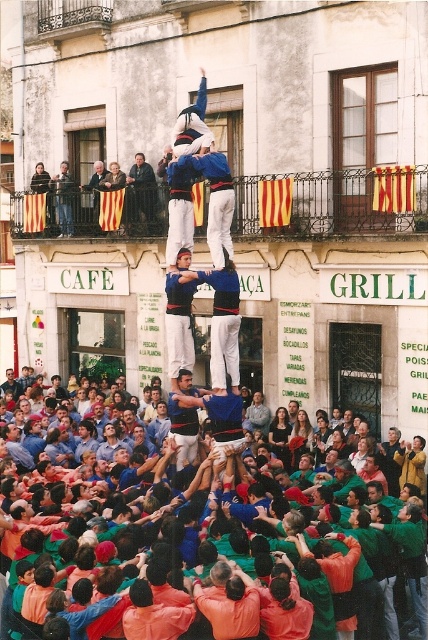
Does dark blue suit at center appear on the right side of denim jeans at upper left?

Yes, dark blue suit at center is to the right of denim jeans at upper left.

Which is more to the left, dark blue suit at center or denim jeans at upper left?

denim jeans at upper left

Where is `dark blue suit at center`? The image size is (428, 640). dark blue suit at center is located at coordinates (140, 193).

Locate an element on the screen. This screenshot has width=428, height=640. dark blue suit at center is located at coordinates (140, 193).

How far apart are orange fabric crowd at center and denim jeans at upper left?

They are 32.09 meters apart.

Is the position of orange fabric crowd at center more distant than that of denim jeans at upper left?

No, it is in front of denim jeans at upper left.

Who is more distant from viewer, (341, 593) or (68, 182)?

The point (68, 182) is more distant.

I want to click on orange fabric crowd at center, so click(181, 522).

Can you confirm if orange fabric crowd at center is smaller than dark blue suit at center?

Incorrect, orange fabric crowd at center is not smaller in size than dark blue suit at center.

Who is more forward, (160,474) or (145,170)?

Positioned in front is point (160,474).

The width and height of the screenshot is (428, 640). I want to click on orange fabric crowd at center, so click(181, 522).